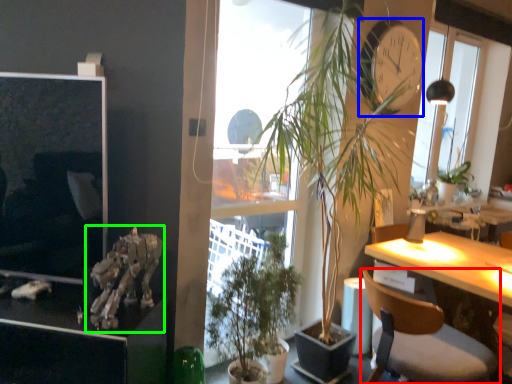
Question: Which object is the closest to the chair (highlighted by a red box)? Choose among these: clock (highlighted by a blue box) or skeleton (highlighted by a green box).

Choices:
 (A) clock
 (B) skeleton

Answer: (A)